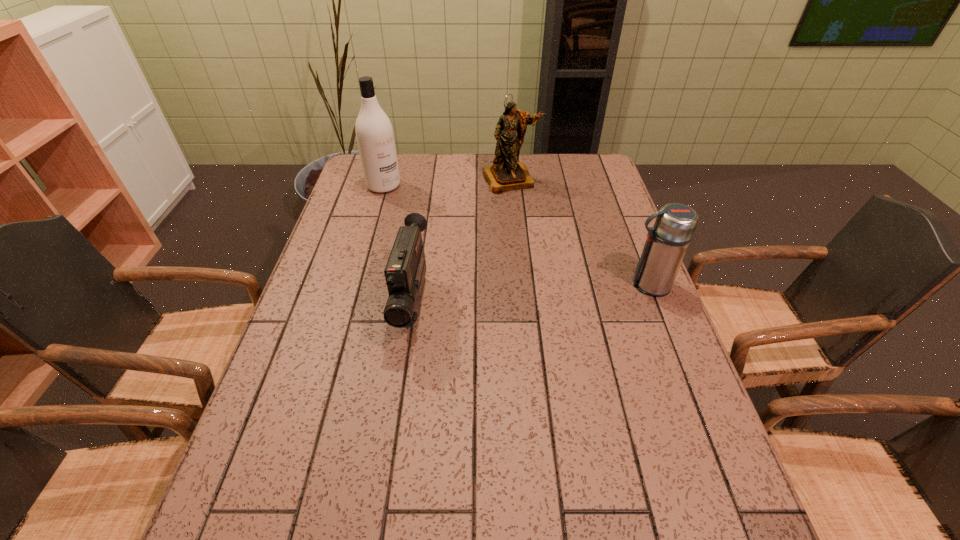
The image size is (960, 540). Identify the location of vacant space that satisfies the following two spatial constraints: 1. on the front side of the rightmost object; 2. with a handle on the side of the tallest object. (355, 285).